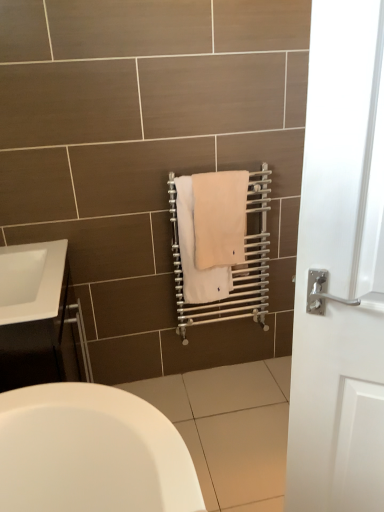
What is the approximate height of beige cotton towel at center, the 2th bath towel viewed from the left?

It is 41.55 centimeters.

You are a GUI agent. You are given a task and a screenshot of the screen. Output one action in this format:
    pyautogui.click(x=<x>, y=<y>)
    Task: Click on the beige cotton towel at center, the 2th bath towel viewed from the right
    The image size is (384, 512).
    Given the screenshot: What is the action you would take?
    pyautogui.click(x=194, y=253)

In order to face white glossy cabinet at left, should I rotate leftwards or rightwards?

It's best to rotate left around 21.210 degrees.

Find the location of a particular element. silver metallic towel rack at center is located at coordinates tap(231, 266).

The height and width of the screenshot is (512, 384). I want to click on beige cotton towel at center, positioned as the 1th bath towel in right-to-left order, so click(219, 218).

Locate an element on the screen. The image size is (384, 512). the 1st bath towel counting from the right of the white glossy cabinet at left is located at coordinates (194, 253).

How many degrees apart are the facing directions of beige cotton towel at center, the 2th bath towel viewed from the right, and white glossy cabinet at left?

90.7 degrees separate the facing orientations of beige cotton towel at center, the 2th bath towel viewed from the right, and white glossy cabinet at left.

Is beige cotton towel at center, placed as the 1th bath towel when sorted from left to right, aimed at white glossy cabinet at left?

No, beige cotton towel at center, placed as the 1th bath towel when sorted from left to right, is not oriented towards white glossy cabinet at left.

Is beige cotton towel at center, placed as the 1th bath towel when sorted from left to right, located outside white glossy cabinet at left?

Yes.

From a real-world perspective, is beige cotton towel at center, the 2th bath towel viewed from the right, on top of white glossy sink at lower left?

Yes.

From the image's perspective, which one is positioned lower, beige cotton towel at center, the 2th bath towel viewed from the right, or white glossy sink at lower left?

From the image's view, white glossy sink at lower left is below.

Find the location of a particular element. This screenshot has height=512, width=384. sink in front of the beige cotton towel at center, the 2th bath towel viewed from the right is located at coordinates click(31, 281).

Is beige cotton towel at center, the 2th bath towel viewed from the right, a part of white glossy sink at lower left?

No, beige cotton towel at center, the 2th bath towel viewed from the right, is not inside white glossy sink at lower left.

From a real-world perspective, between white glossy sink at lower left and beige cotton towel at center, the 2th bath towel viewed from the right, who is vertically lower?

In real-world perspective, white glossy sink at lower left is lower.

Is white glossy sink at lower left closer to camera compared to beige cotton towel at center, placed as the 1th bath towel when sorted from left to right?

That is True.

Can you confirm if white glossy sink at lower left is bigger than beige cotton towel at center, the 2th bath towel viewed from the right?

Yes, white glossy sink at lower left is bigger than beige cotton towel at center, the 2th bath towel viewed from the right.

The image size is (384, 512). Identify the location of balustrade below the beige cotton towel at center, positioned as the 1th bath towel in right-to-left order (from the image's perspective). (231, 266).

Which of these two, silver metallic towel rack at center or beige cotton towel at center, positioned as the 1th bath towel in right-to-left order, is wider?

Wider between the two is beige cotton towel at center, positioned as the 1th bath towel in right-to-left order.

Does silver metallic towel rack at center turn towards beige cotton towel at center, the 2th bath towel viewed from the left?

Yes, silver metallic towel rack at center is aimed at beige cotton towel at center, the 2th bath towel viewed from the left.

From a real-world perspective, which object stands above the other?

beige cotton towel at center, the 2th bath towel viewed from the right.

Can you tell me how much white glossy cabinet at left and beige cotton towel at center, the 2th bath towel viewed from the right, differ in facing direction?

white glossy cabinet at left and beige cotton towel at center, the 2th bath towel viewed from the right, are facing 90.7 degrees away from each other.

Is white glossy cabinet at left positioned far away from beige cotton towel at center, placed as the 1th bath towel when sorted from left to right?

white glossy cabinet at left is actually quite close to beige cotton towel at center, placed as the 1th bath towel when sorted from left to right.

Considering the relative sizes of white glossy cabinet at left and beige cotton towel at center, the 2th bath towel viewed from the right, in the image provided, is white glossy cabinet at left smaller than beige cotton towel at center, the 2th bath towel viewed from the right,?

Actually, white glossy cabinet at left might be larger than beige cotton towel at center, the 2th bath towel viewed from the right.

Does silver metallic towel rack at center contain beige cotton towel at center, placed as the 1th bath towel when sorted from left to right?

Yes, beige cotton towel at center, placed as the 1th bath towel when sorted from left to right, can be found within silver metallic towel rack at center.

Considering the sizes of objects silver metallic towel rack at center and beige cotton towel at center, placed as the 1th bath towel when sorted from left to right, in the image provided, who is shorter, silver metallic towel rack at center or beige cotton towel at center, placed as the 1th bath towel when sorted from left to right,?

With less height is beige cotton towel at center, placed as the 1th bath towel when sorted from left to right.

Is silver metallic towel rack at center far from beige cotton towel at center, placed as the 1th bath towel when sorted from left to right?

silver metallic towel rack at center is actually quite close to beige cotton towel at center, placed as the 1th bath towel when sorted from left to right.

At what (x,y) coordinates should I click in order to perform the action: click on balustrade behind the beige cotton towel at center, placed as the 1th bath towel when sorted from left to right. Please return your answer as a coordinate pair (x, y). Looking at the image, I should click on (231, 266).

Is silver metallic towel rack at center wider or thinner than white glossy cabinet at left?

Considering their sizes, silver metallic towel rack at center looks slimmer than white glossy cabinet at left.

Can you confirm if silver metallic towel rack at center is shorter than white glossy cabinet at left?

In fact, silver metallic towel rack at center may be taller than white glossy cabinet at left.

Is silver metallic towel rack at center beside white glossy cabinet at left?

No, silver metallic towel rack at center is not next to white glossy cabinet at left.

Is silver metallic towel rack at center further to camera compared to white glossy cabinet at left?

Yes, it is behind white glossy cabinet at left.

Starting from the white glossy cabinet at left, which bath towel is the 2nd one behind? Please provide its 2D coordinates.

[(194, 253)]

The height and width of the screenshot is (512, 384). I want to click on the 1st bath towel above the white glossy sink at lower left (from the image's perspective), so click(194, 253).

Looking at the image, which one is located further to beige cotton towel at center, the 2th bath towel viewed from the right, white glossy cabinet at left or beige cotton towel at center, the 2th bath towel viewed from the left?

Among the two, white glossy cabinet at left is located further to beige cotton towel at center, the 2th bath towel viewed from the right.

Based on their spatial positions, is beige cotton towel at center, the 2th bath towel viewed from the left, or white glossy cabinet at left further from silver metallic towel rack at center?

The object further to silver metallic towel rack at center is white glossy cabinet at left.

When comparing their distances from beige cotton towel at center, placed as the 1th bath towel when sorted from left to right, does white glossy sink at lower left or white glossy cabinet at left seem closer?

Among the two, white glossy cabinet at left is located nearer to beige cotton towel at center, placed as the 1th bath towel when sorted from left to right.

Based on their spatial positions, is white glossy sink at lower left or white glossy cabinet at left closer to silver metallic towel rack at center?

white glossy cabinet at left is closer to silver metallic towel rack at center.

From the image, which object appears to be farther from white glossy cabinet at left, beige cotton towel at center, the 2th bath towel viewed from the left, or beige cotton towel at center, the 2th bath towel viewed from the right?

beige cotton towel at center, the 2th bath towel viewed from the left, is further to white glossy cabinet at left.

From the image, which object appears to be nearer to silver metallic towel rack at center, white glossy sink at lower left or beige cotton towel at center, the 2th bath towel viewed from the left?

Among the two, beige cotton towel at center, the 2th bath towel viewed from the left, is located nearer to silver metallic towel rack at center.

In the scene shown: When comparing their distances from silver metallic towel rack at center, does beige cotton towel at center, placed as the 1th bath towel when sorted from left to right, or white glossy cabinet at left seem further?

white glossy cabinet at left is further to silver metallic towel rack at center.

Based on their spatial positions, is beige cotton towel at center, positioned as the 1th bath towel in right-to-left order, or white glossy sink at lower left further from white glossy cabinet at left?

beige cotton towel at center, positioned as the 1th bath towel in right-to-left order, is further to white glossy cabinet at left.

The height and width of the screenshot is (512, 384). Find the location of `bath towel between beige cotton towel at center, positioned as the 1th bath towel in right-to-left order, and silver metallic towel rack at center in the up-down direction`. bath towel between beige cotton towel at center, positioned as the 1th bath towel in right-to-left order, and silver metallic towel rack at center in the up-down direction is located at coordinates (194, 253).

Where is `bath towel between white glossy cabinet at left and beige cotton towel at center, the 2th bath towel viewed from the left, in the horizontal direction`? This screenshot has height=512, width=384. bath towel between white glossy cabinet at left and beige cotton towel at center, the 2th bath towel viewed from the left, in the horizontal direction is located at coordinates (194, 253).

Where is `bathroom cabinet between white glossy sink at lower left and silver metallic towel rack at center in the horizontal direction`? The width and height of the screenshot is (384, 512). bathroom cabinet between white glossy sink at lower left and silver metallic towel rack at center in the horizontal direction is located at coordinates (35, 314).

Identify the location of bathroom cabinet between white glossy sink at lower left and beige cotton towel at center, the 2th bath towel viewed from the right. click(x=35, y=314).